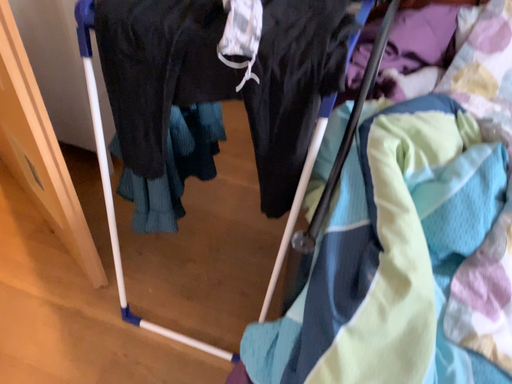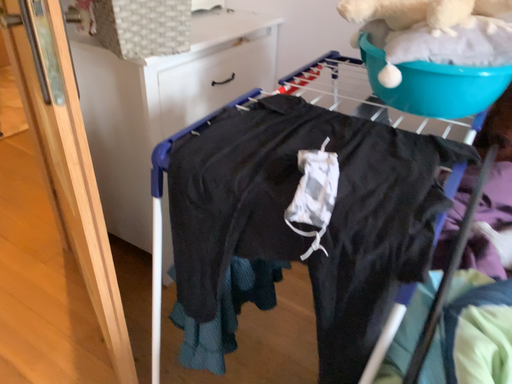
Question: How did the camera likely rotate when shooting the video?

Choices:
 (A) rotated upward
 (B) rotated downward

Answer: (A)